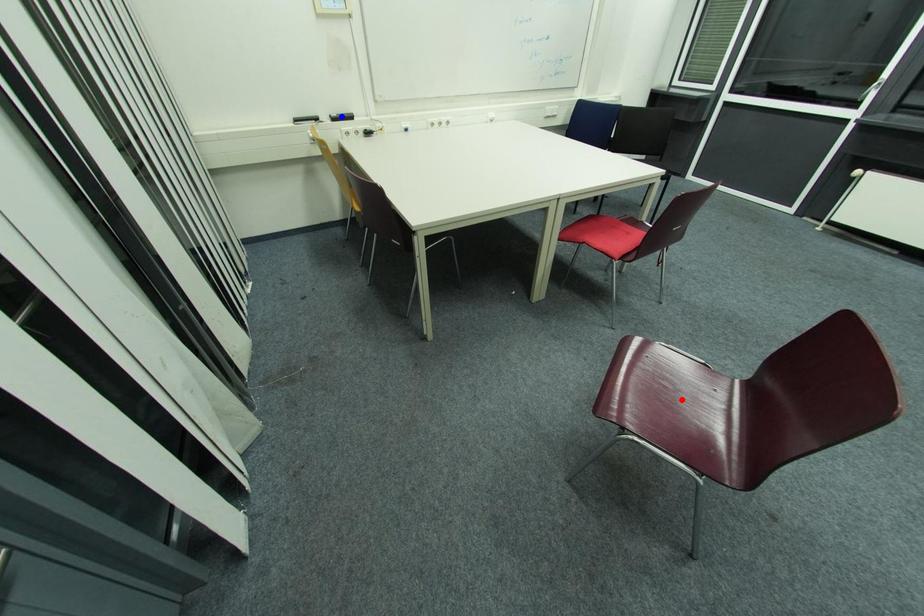
Question: In the image, two points are highlighted. Which point is nearer to the camera? Reply with the corresponding letter.

Choices:
 (A) blue point
 (B) red point

Answer: (B)